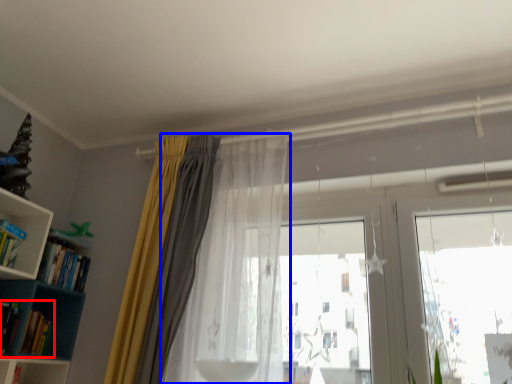
Question: Among these objects, which one is nearest to the camera, book (highlighted by a red box) or curtain (highlighted by a blue box)?

Choices:
 (A) book
 (B) curtain

Answer: (B)